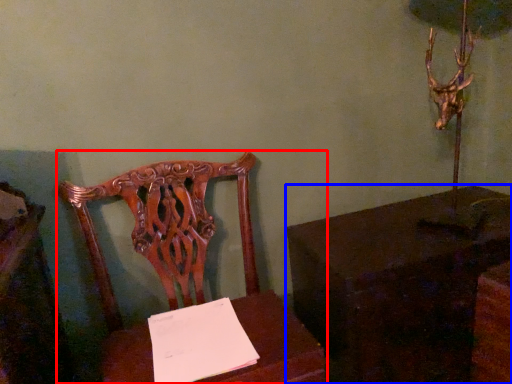
Question: Which of the following is the closest to the observer, chair (highlighted by a red box) or table (highlighted by a blue box)?

Choices:
 (A) chair
 (B) table

Answer: (A)